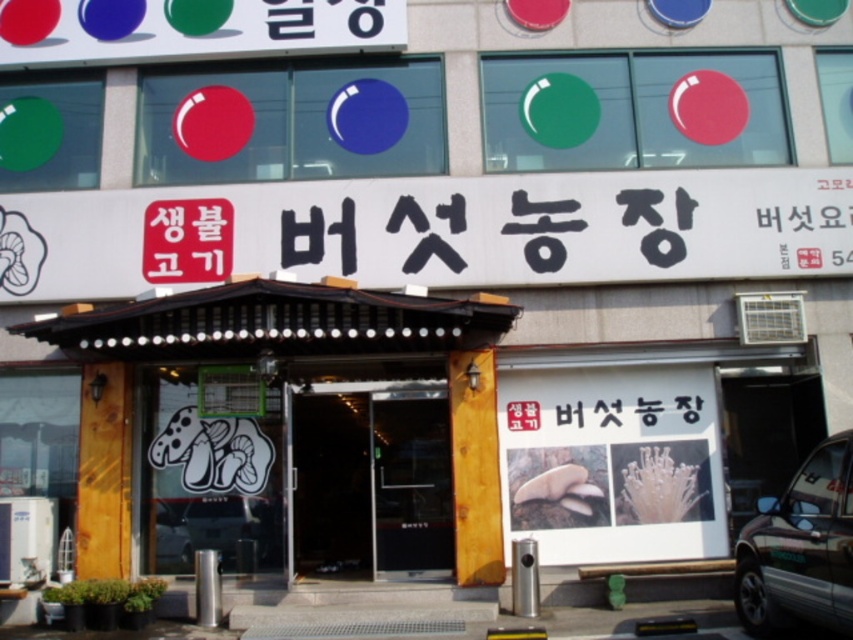
You are a customer standing in front of the store entrance. You see a metallic silver car at center and a red paper sign at center. Which object is shorter?

The metallic silver car at center is shorter than the red paper sign at center.